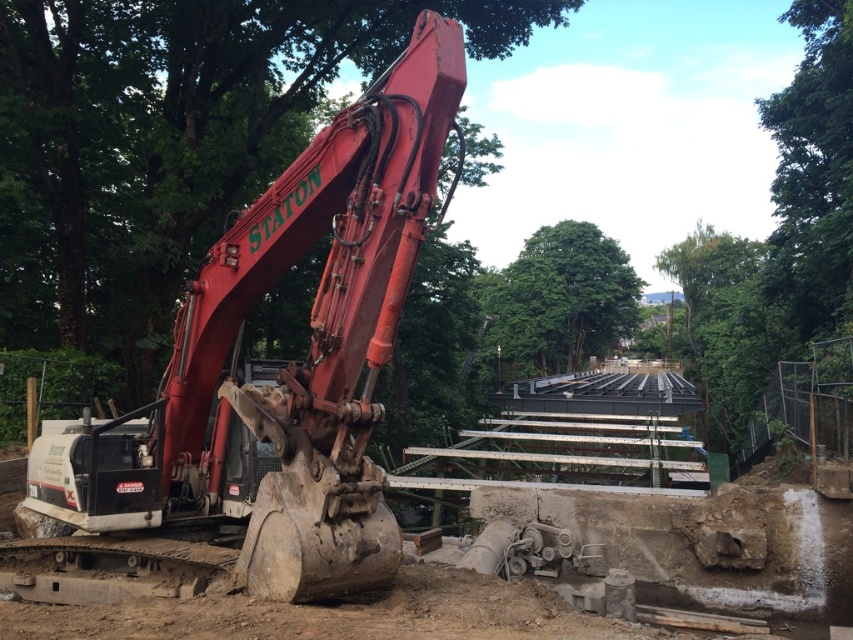
Question: Does matte red excavator at center have a smaller size compared to green leafy tree at center?

Choices:
 (A) yes
 (B) no

Answer: (A)

Question: Is matte red excavator at center wider than green leafy tree at center?

Choices:
 (A) yes
 (B) no

Answer: (B)

Question: Can you confirm if matte red excavator at center is wider than green leafy tree at center?

Choices:
 (A) yes
 (B) no

Answer: (B)

Question: Which object appears farthest from the camera in this image?

Choices:
 (A) green leafy tree at center
 (B) matte red excavator at center

Answer: (A)

Question: Which point is closer to the camera taking this photo?

Choices:
 (A) pyautogui.click(x=543, y=282)
 (B) pyautogui.click(x=355, y=224)

Answer: (B)